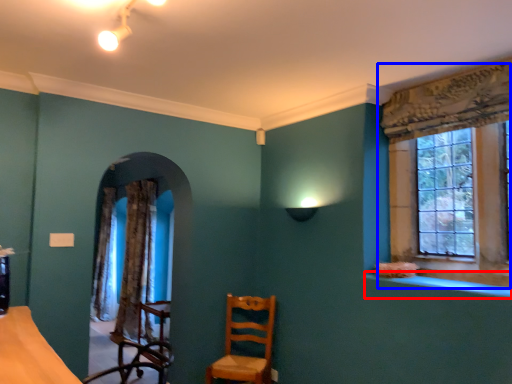
Question: Which object is closer to the camera taking this photo, window sill (highlighted by a red box) or window (highlighted by a blue box)?

Choices:
 (A) window sill
 (B) window

Answer: (A)